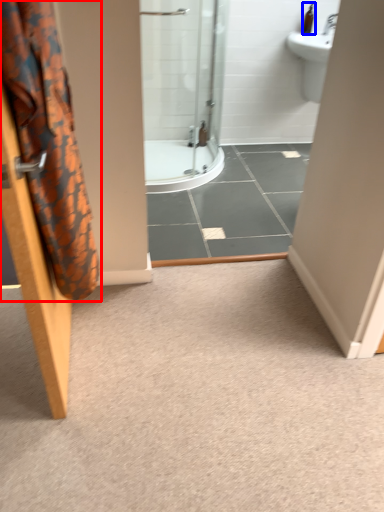
Question: Which point is further to the camera, shower curtain (highlighted by a red box) or toiletry (highlighted by a blue box)?

Choices:
 (A) shower curtain
 (B) toiletry

Answer: (B)